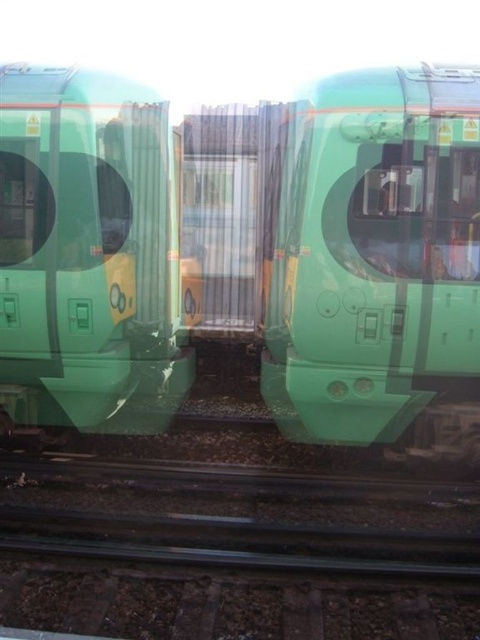
Question: Is green matte train at center positioned before green matte train at left?

Choices:
 (A) yes
 (B) no

Answer: (A)

Question: Is black metal train track at center thinner than green matte train at left?

Choices:
 (A) yes
 (B) no

Answer: (B)

Question: Estimate the real-world distances between objects in this image. Which object is closer to the black metal train track at center?

Choices:
 (A) green matte train at center
 (B) green matte train at left

Answer: (A)

Question: Which of the following is the closest to the observer?

Choices:
 (A) 193,300
 (B) 168,408

Answer: (B)

Question: Which of the following is the farthest from the observer?

Choices:
 (A) black metal train track at center
 (B) green matte train at left
 (C) green matte train at center

Answer: (B)

Question: Does black metal train track at center come behind green matte train at left?

Choices:
 (A) no
 (B) yes

Answer: (A)